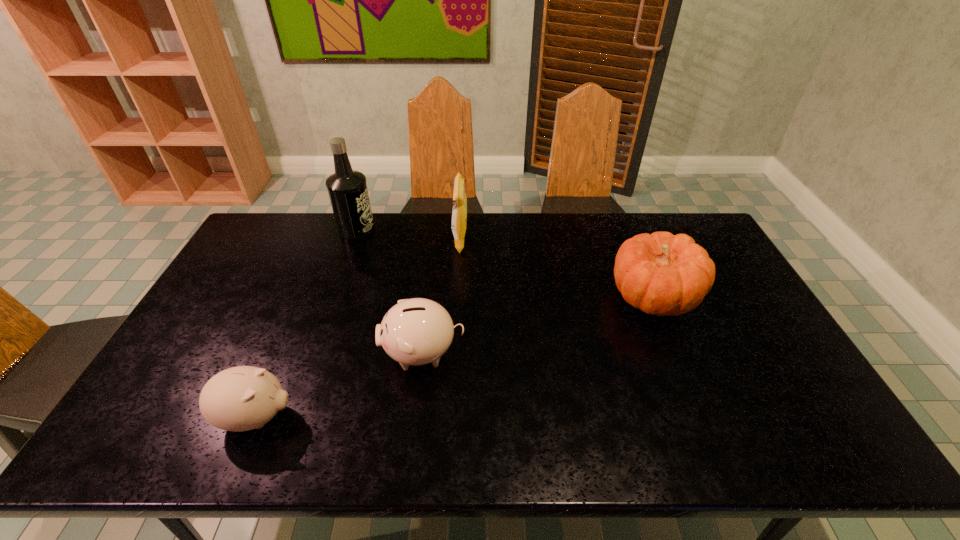
Locate an element on the screen. free space that is in between the pumpkin and the right piggy bank is located at coordinates (538, 325).

Locate an element on the screen. The image size is (960, 540). free area in between the left piggy bank and the right piggy bank is located at coordinates (340, 385).

This screenshot has width=960, height=540. I want to click on free spot between the fourth shortest object and the tallest object, so click(408, 235).

Find the location of a particular element. This screenshot has width=960, height=540. free point between the shorter piggy bank and the crisp (potato chip) is located at coordinates (358, 329).

Locate an element on the screen. The height and width of the screenshot is (540, 960). free spot between the liquor and the pumpkin is located at coordinates (504, 262).

You are a GUI agent. You are given a task and a screenshot of the screen. Output one action in this format:
    pyautogui.click(x=<x>, y=<y>)
    Task: Click on the free point between the shorter piggy bank and the rightmost object
    The width and height of the screenshot is (960, 540).
    Given the screenshot: What is the action you would take?
    pyautogui.click(x=454, y=356)

At what (x,y) coordinates should I click in order to perform the action: click on free point between the second tallest object and the rightmost object. Please return your answer as a coordinate pair (x, y). Looking at the image, I should click on (556, 268).

At what (x,y) coordinates should I click in order to perform the action: click on free space between the farther piggy bank and the pumpkin. Please return your answer as a coordinate pair (x, y). This screenshot has height=540, width=960. Looking at the image, I should click on (538, 325).

The image size is (960, 540). Identify the location of blank region between the nearer piggy bank and the liquor. (306, 323).

Identify the location of vacant point located between the nearest object and the crisp (potato chip). (358, 329).